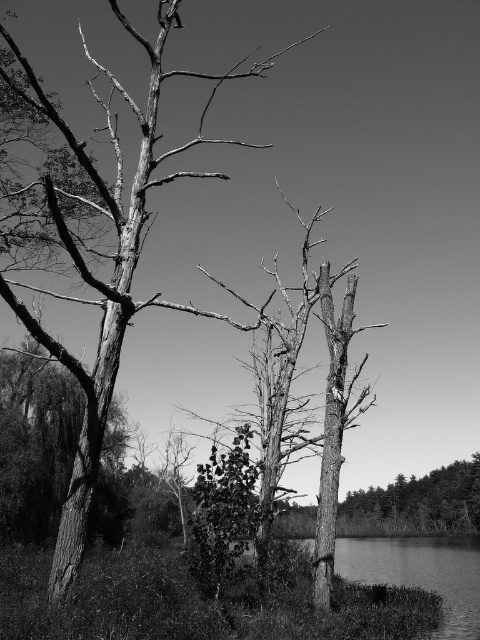
You are standing at the edge of the scene near the smooth water at lower right and want to walk to the smooth bark tree at lower right. Which direction should you move to reach the tree?

The smooth water at lower right is wider than the smooth bark tree at lower right, so you should move to the left to reach the tree.